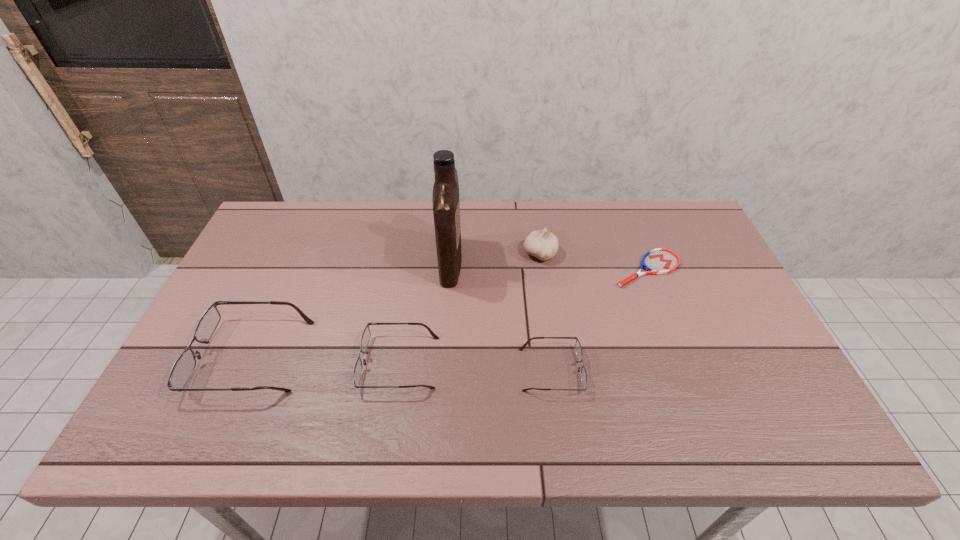
Please show where to add a spectacles on the right while keeping spacing even. Please provide its 2D coordinates. Your answer should be formatted as a tuple, i.e. [(x, y)], where the tuple contains the x and y coordinates of a point satisfying the conditions above.

[(708, 377)]